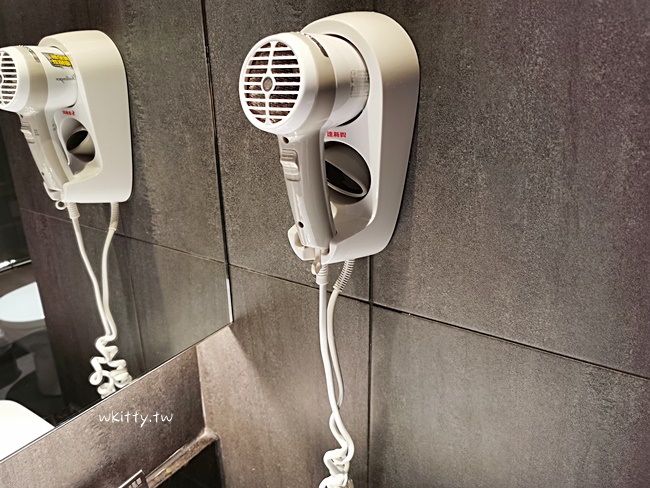
Image resolution: width=650 pixels, height=488 pixels. I want to click on reflection of hair dryer, so click(x=90, y=76).